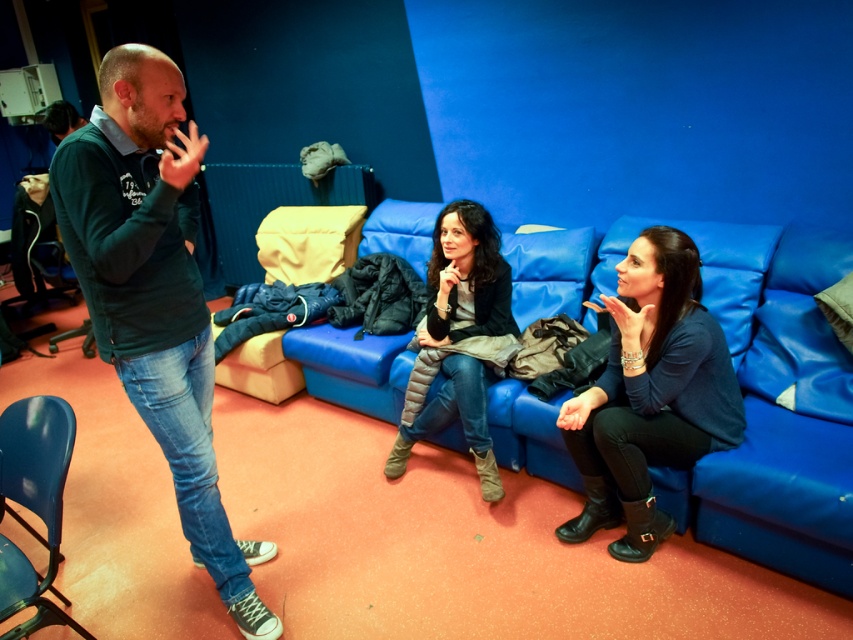
How much distance is there between dark green sweater at left and matte black sweater at center?

4.09 feet

Can you confirm if dark green sweater at left is thinner than matte black sweater at center?

Yes, dark green sweater at left is thinner than matte black sweater at center.

This screenshot has width=853, height=640. I want to click on dark green sweater at left, so click(x=155, y=292).

Is blue leather couch at center further to camera compared to dark gray quilted jacket at center?

No, blue leather couch at center is closer to the viewer.

Which of these two, blue leather couch at center or dark gray quilted jacket at center, stands shorter?

With less height is dark gray quilted jacket at center.

Is point (490, 422) behind point (480, 426)?

That is True.

You are a GUI agent. You are given a task and a screenshot of the screen. Output one action in this format:
    pyautogui.click(x=<x>, y=<y>)
    Task: Click on the blue leather couch at center
    
    Given the screenshot: What is the action you would take?
    pyautogui.click(x=764, y=404)

Between blue leather couch at center and dark green sweater at left, which one has more height?

dark green sweater at left is taller.

Between point (734, 468) and point (91, 145), which one is positioned in front?

Point (91, 145) is more forward.

I want to click on blue leather couch at center, so click(x=764, y=404).